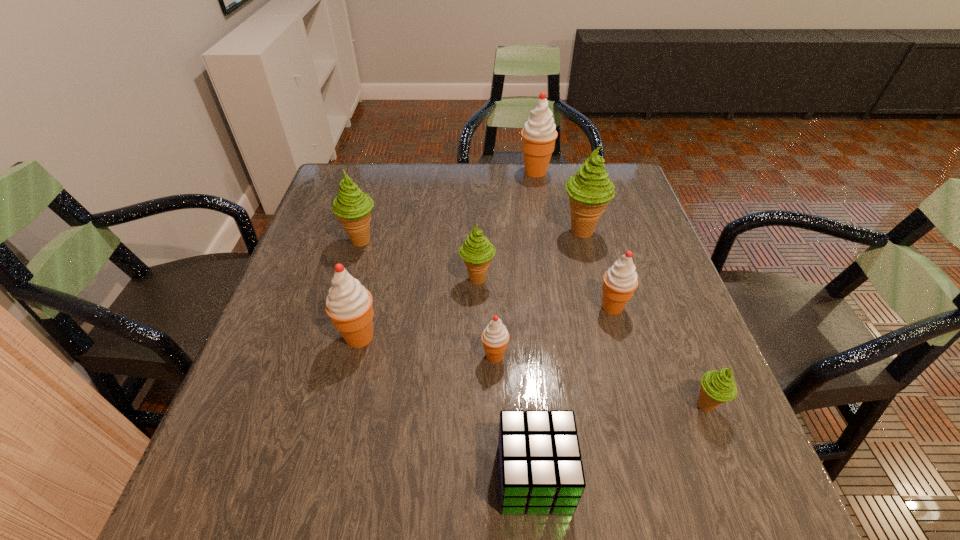
This screenshot has width=960, height=540. Identify the location of the farthest icecream. (539, 133).

The image size is (960, 540). In order to click on the second red icecream from right to left in this screenshot , I will do `click(539, 133)`.

Locate an element on the screen. The height and width of the screenshot is (540, 960). the second green icecream from right to left is located at coordinates (590, 190).

You are a GUI agent. You are given a task and a screenshot of the screen. Output one action in this format:
    pyautogui.click(x=<x>, y=<y>)
    Task: Click on the third smallest green icecream
    This screenshot has height=540, width=960.
    Given the screenshot: What is the action you would take?
    pyautogui.click(x=352, y=207)

You are a GUI agent. You are given a task and a screenshot of the screen. Output one action in this format:
    pyautogui.click(x=<x>, y=<y>)
    Task: Click on the leftmost red icecream
    
    Given the screenshot: What is the action you would take?
    pyautogui.click(x=349, y=304)

Where is `the fifth nearest object`? The width and height of the screenshot is (960, 540). the fifth nearest object is located at coordinates (620, 281).

This screenshot has width=960, height=540. What are the coordinates of `the fourth nearest icecream` in the screenshot? It's located at pos(620,281).

I want to click on the sixth nearest object, so click(477, 251).

Locate an element on the screen. Image resolution: width=960 pixels, height=540 pixels. the third green icecream from right to left is located at coordinates (477, 251).

You are a GUI agent. You are given a task and a screenshot of the screen. Output one action in this format:
    pyautogui.click(x=<x>, y=<y>)
    Task: Click on the second red icecream from left to right
    This screenshot has width=960, height=540.
    Given the screenshot: What is the action you would take?
    pyautogui.click(x=495, y=337)